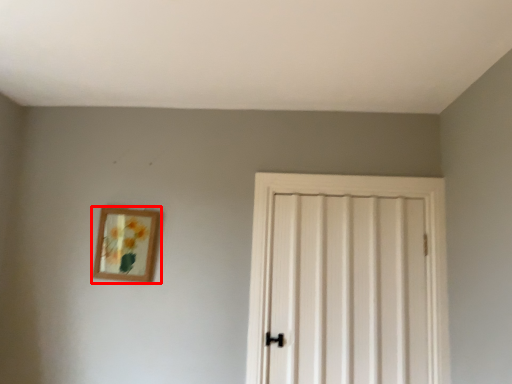
Question: Observing the image, what is the correct spatial positioning of picture frame (annotated by the red box) in reference to door?

Choices:
 (A) right
 (B) left

Answer: (B)